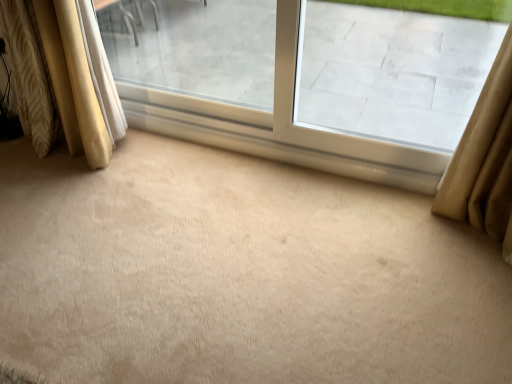
Question: Does transparent glass window at center have a greater width compared to woven fabric curtain at left, which is the 1th curtain in left-to-right order?

Choices:
 (A) no
 (B) yes

Answer: (A)

Question: Is transparent glass window at center beside woven fabric curtain at left, which is the 1th curtain in left-to-right order?

Choices:
 (A) yes
 (B) no

Answer: (B)

Question: Is woven fabric curtain at left, acting as the 2th curtain starting from the right, located within transparent glass window at center?

Choices:
 (A) no
 (B) yes

Answer: (A)

Question: Can you confirm if transparent glass window at center is thinner than woven fabric curtain at left, acting as the 2th curtain starting from the right?

Choices:
 (A) yes
 (B) no

Answer: (A)

Question: From the image's perspective, does transparent glass window at center appear lower than woven fabric curtain at left, which is the 1th curtain in left-to-right order?

Choices:
 (A) yes
 (B) no

Answer: (A)

Question: From the image's perspective, is transparent glass window at upper right positioned above or below transparent glass window at center?

Choices:
 (A) below
 (B) above

Answer: (A)

Question: From a real-world perspective, is transparent glass window at upper right physically located above or below transparent glass window at center?

Choices:
 (A) below
 (B) above

Answer: (B)

Question: Based on their sizes in the image, would you say transparent glass window at upper right is bigger or smaller than transparent glass window at center?

Choices:
 (A) big
 (B) small

Answer: (B)

Question: Is transparent glass window at upper right situated inside transparent glass window at center or outside?

Choices:
 (A) outside
 (B) inside

Answer: (B)

Question: Is point coord(369,110) positioned closer to the camera than point coord(36,86)?

Choices:
 (A) farther
 (B) closer

Answer: (A)

Question: Is transparent glass window at center in front of or behind woven fabric curtain at left, acting as the 2th curtain starting from the right, in the image?

Choices:
 (A) front
 (B) behind

Answer: (A)

Question: Considering the positions of transparent glass window at center and woven fabric curtain at left, which is the 1th curtain in left-to-right order, in the image, is transparent glass window at center taller or shorter than woven fabric curtain at left, which is the 1th curtain in left-to-right order,?

Choices:
 (A) short
 (B) tall

Answer: (B)

Question: From a real-world perspective, relative to woven fabric curtain at left, acting as the 2th curtain starting from the right, is transparent glass window at center vertically above or below?

Choices:
 (A) above
 (B) below

Answer: (A)

Question: From the image's perspective, relative to beige fabric curtain at left, the second curtain when ordered from left to right, is transparent glass window at upper right above or below?

Choices:
 (A) above
 (B) below

Answer: (B)

Question: In the image, is transparent glass window at upper right positioned in front of or behind beige fabric curtain at left, the second curtain when ordered from left to right?

Choices:
 (A) front
 (B) behind

Answer: (A)